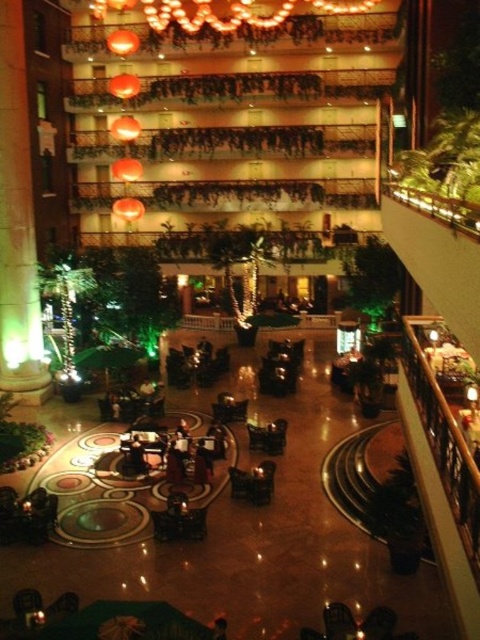
You are standing in the atrium and want to reach the entrance located at point (1,13). Given that the average walking speed is 3 feet per second, how many seconds will it take you to reach the entrance?

The distance between you and the entrance at point (1,13) is 68.27 feet. Dividing the distance by the walking speed of 3 feet per second gives approximately 22.76 seconds. Therefore, it will take about 23 seconds to reach the entrance.

You are standing in the atrium and want to take a photo of the green marble pillar at left. If your camera has a maximum focus range of 20 meters, will it be able to capture the pillar clearly?

The distance between the green marble pillar at left and the camera is 20.69 meters, which exceeds the camera maximum focus range of 20 meters. Therefore, the camera cannot capture the pillar clearly.